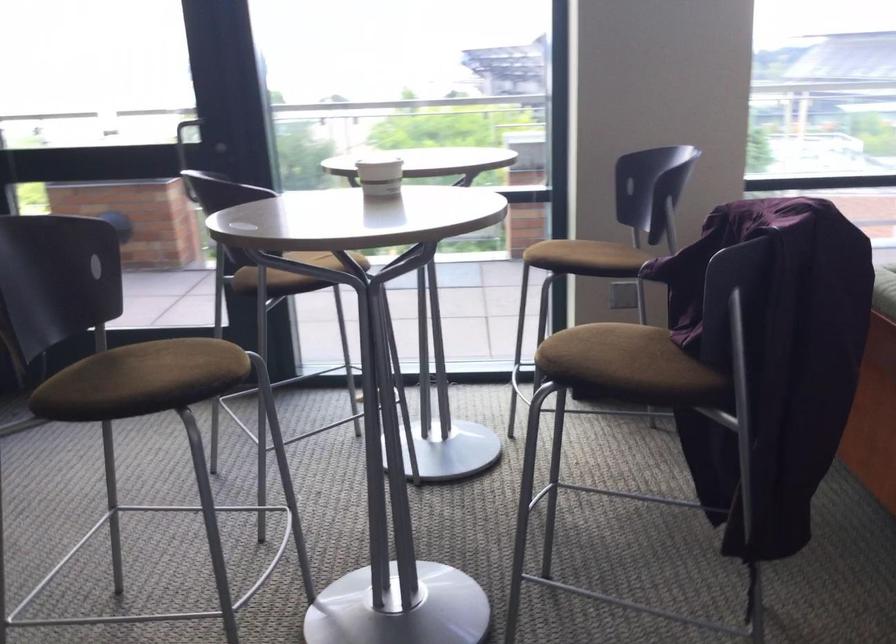
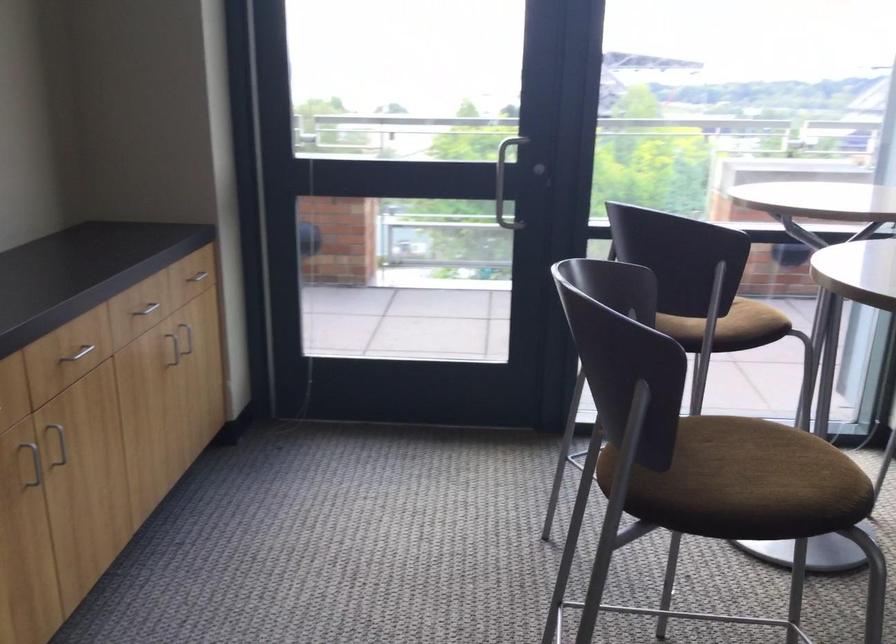
Find the pixel in the second image that matches pixel 263 138 in the first image.

(503, 173)